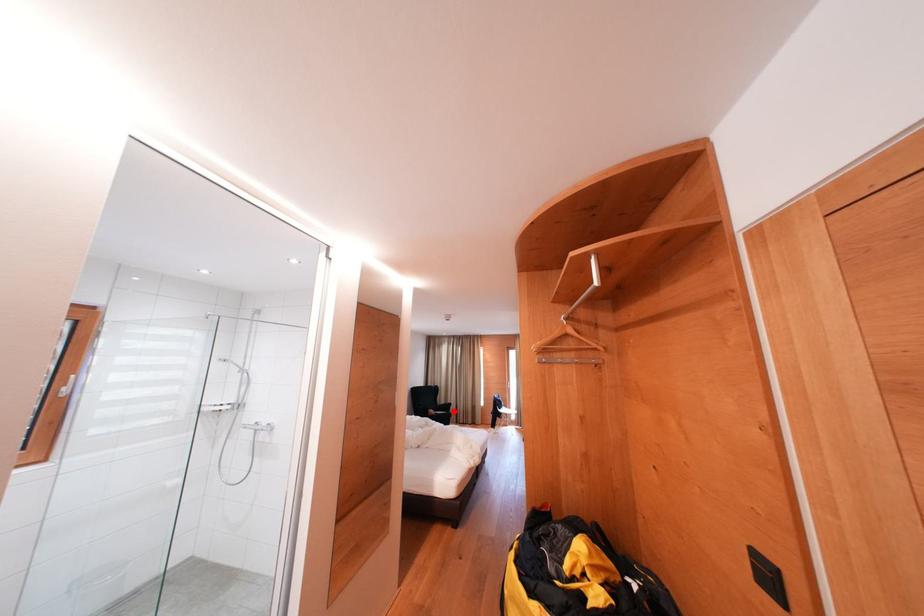
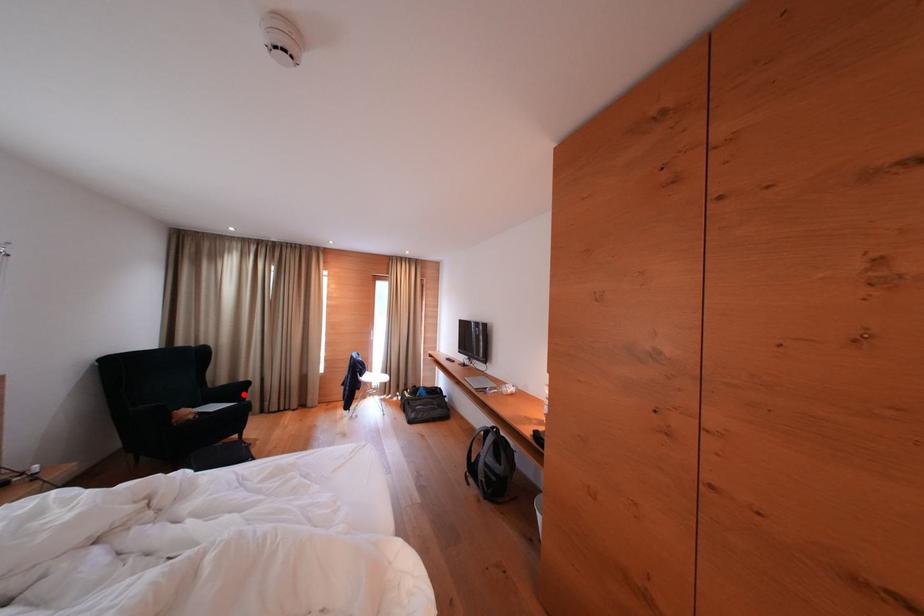
I am providing you with two images of the same scene from different viewpoints. A red point is marked on the first image and another point is marked on the second image. Is the red point in image1 aligned with the point shown in image2?

Yes